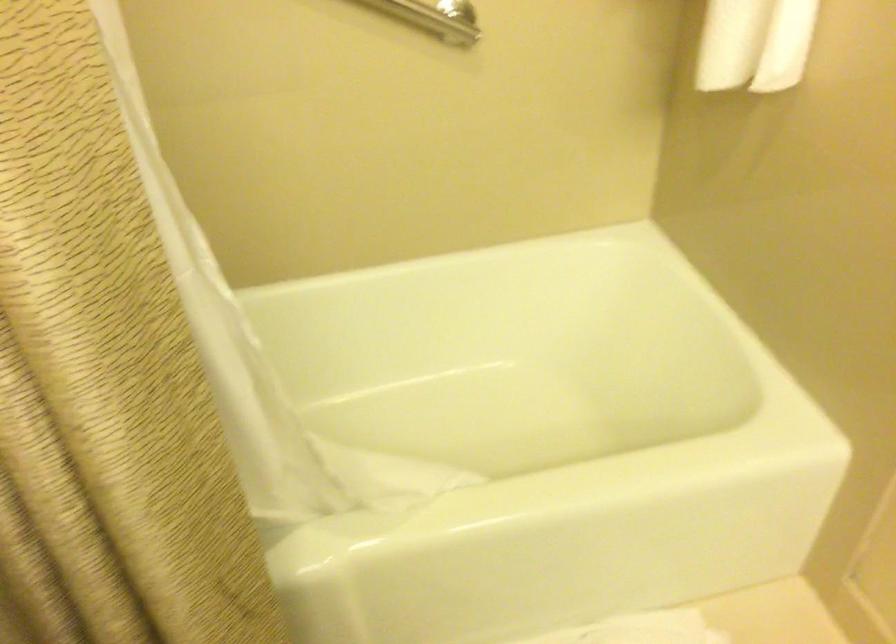
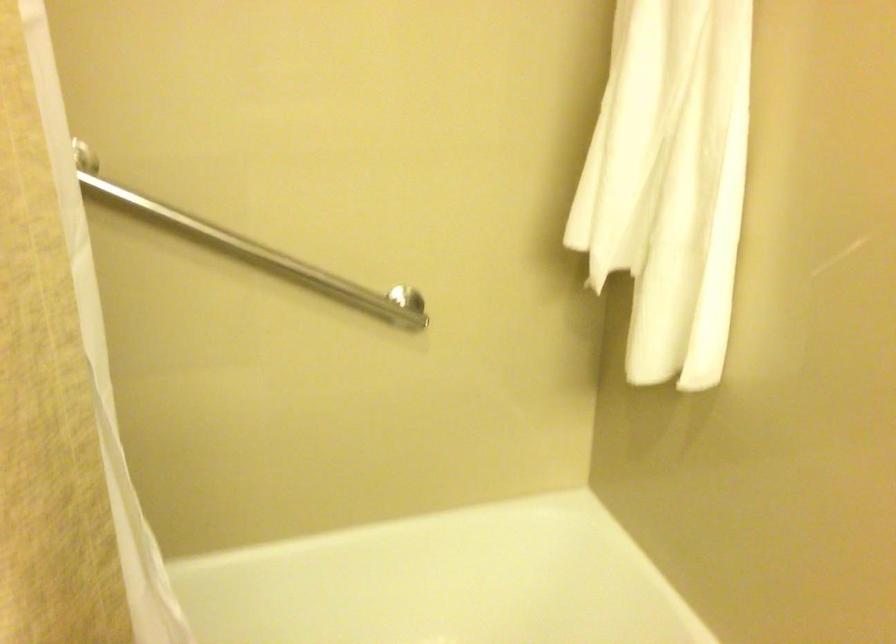
The images are taken continuously from a first-person perspective. In which direction are you moving?

The cameraman walked toward left, backward.